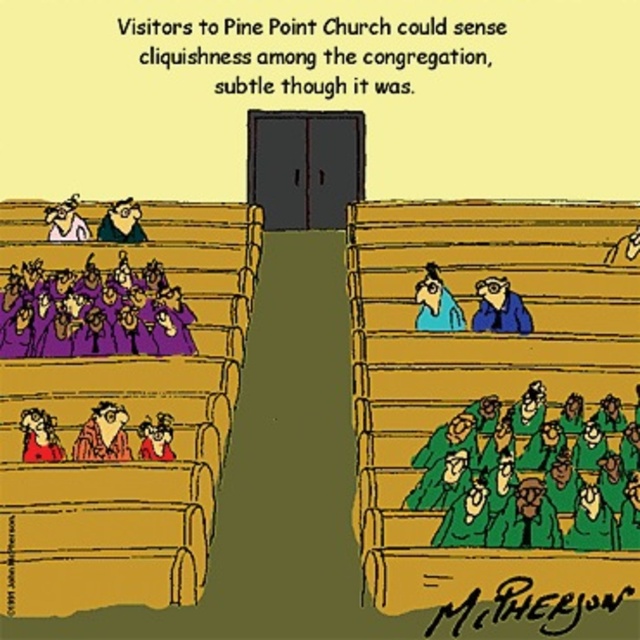
Looking at this image, you are standing at the entrance of Pine Point Church and notice the purple matte choir robes at center. Based on their position, can you determine if they are closer to the front or back of the church?

The purple matte choir robes at center are positioned at coordinates point (92, 312), which places them closer to the front of the church since the y coordinate 0.145 is closer to the top of the image, indicating proximity to the front.

You are a visitor at Pine Point Church and notice two items in the scene. One is the purple matte choir robes at center and the other is the brown textured coat at lower left. Which item is placed higher up in the image?

The purple matte choir robes at center is positioned over the brown textured coat at lower left, so the purple matte choir robes at center is higher up.